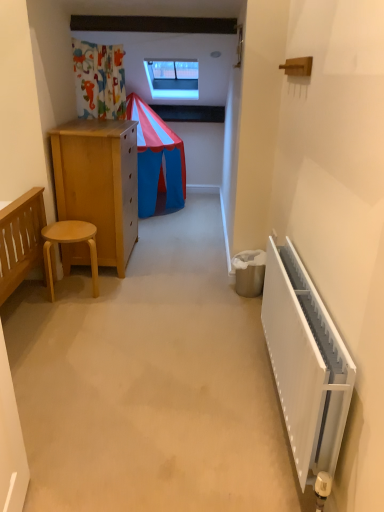
Question: Is the depth of transparent glass window at upper center less than that of light wood stool at left?

Choices:
 (A) yes
 (B) no

Answer: (B)

Question: Can you confirm if transparent glass window at upper center is smaller than light wood stool at left?

Choices:
 (A) yes
 (B) no

Answer: (B)

Question: Can you confirm if transparent glass window at upper center is taller than light wood stool at left?

Choices:
 (A) no
 (B) yes

Answer: (B)

Question: Can you confirm if transparent glass window at upper center is thinner than light wood stool at left?

Choices:
 (A) yes
 (B) no

Answer: (B)

Question: Is transparent glass window at upper center to the left of light wood stool at left from the viewer's perspective?

Choices:
 (A) yes
 (B) no

Answer: (B)

Question: Looking at their shapes, would you say white plastic radiator at right is wider or thinner than light wood stool at left?

Choices:
 (A) thin
 (B) wide

Answer: (A)

Question: From a real-world perspective, relative to light wood stool at left, is white plastic radiator at right vertically above or below?

Choices:
 (A) below
 (B) above

Answer: (B)

Question: In terms of size, does white plastic radiator at right appear bigger or smaller than light wood stool at left?

Choices:
 (A) big
 (B) small

Answer: (A)

Question: Is white plastic radiator at right spatially inside light wood stool at left, or outside of it?

Choices:
 (A) outside
 (B) inside

Answer: (A)

Question: Is white plastic radiator at right taller or shorter than transparent glass window at upper center?

Choices:
 (A) tall
 (B) short

Answer: (B)

Question: Looking at their shapes, would you say white plastic radiator at right is wider or thinner than transparent glass window at upper center?

Choices:
 (A) thin
 (B) wide

Answer: (A)

Question: Is white plastic radiator at right bigger or smaller than transparent glass window at upper center?

Choices:
 (A) small
 (B) big

Answer: (A)

Question: Considering their positions, is white plastic radiator at right located in front of or behind transparent glass window at upper center?

Choices:
 (A) front
 (B) behind

Answer: (A)

Question: From the image's perspective, is transparent glass window at upper center above or below light wood stool at left?

Choices:
 (A) above
 (B) below

Answer: (A)

Question: From a real-world perspective, is transparent glass window at upper center above or below light wood stool at left?

Choices:
 (A) below
 (B) above

Answer: (B)